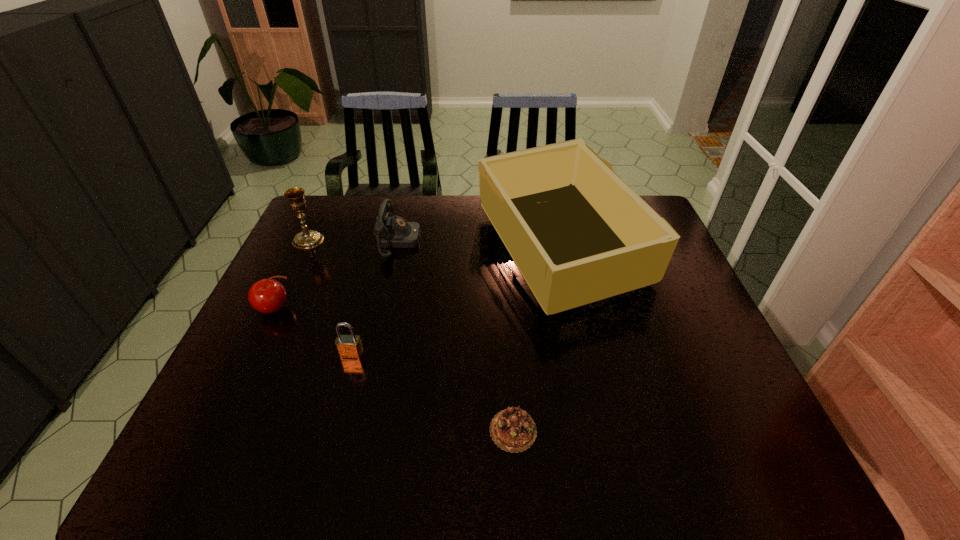
This screenshot has width=960, height=540. In order to click on object present at the far left corner in this screenshot , I will do `click(307, 239)`.

Locate an element on the screen. This screenshot has width=960, height=540. object positioned at the far right corner is located at coordinates (577, 233).

Find the location of a particular element. vacant area at the far edge of the desktop is located at coordinates (372, 195).

I want to click on vacant region at the near edge of the desktop, so click(613, 474).

At what (x,y) coordinates should I click in order to perform the action: click on vacant space at the left edge of the desktop. Please return your answer as a coordinate pair (x, y). Looking at the image, I should click on (269, 375).

The width and height of the screenshot is (960, 540). In the image, there is a desktop. What are the coordinates of `vacant space at the right edge` in the screenshot? It's located at (704, 316).

Identify the location of vacant space at the far left corner of the desktop. This screenshot has width=960, height=540. (310, 208).

Identify the location of vacant area at the near left corner of the desktop. Image resolution: width=960 pixels, height=540 pixels. (227, 465).

Find the location of `free spot between the shortest object and the cherry`. free spot between the shortest object and the cherry is located at coordinates (395, 369).

Locate an element on the screen. The height and width of the screenshot is (540, 960). vacant space that is in between the shortest object and the chalice is located at coordinates (411, 335).